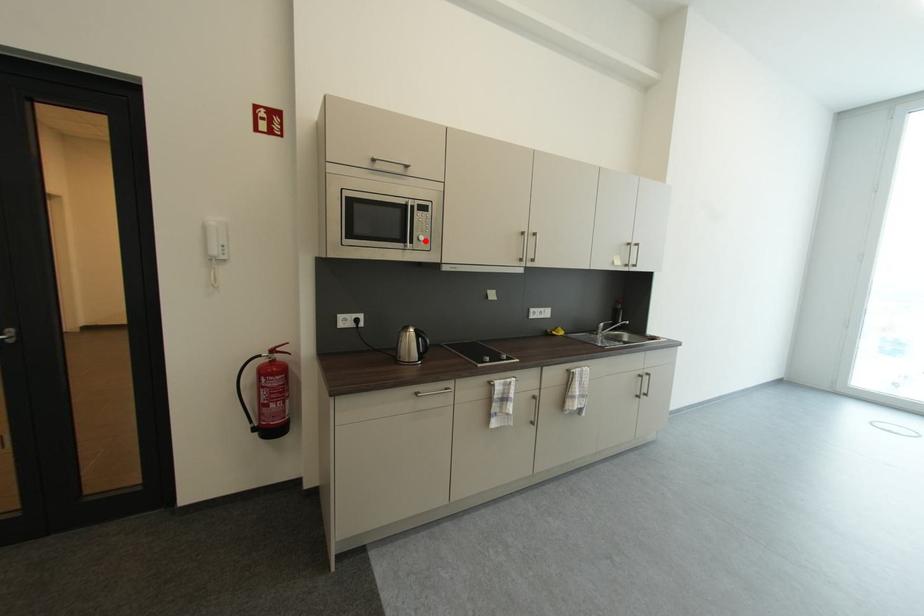
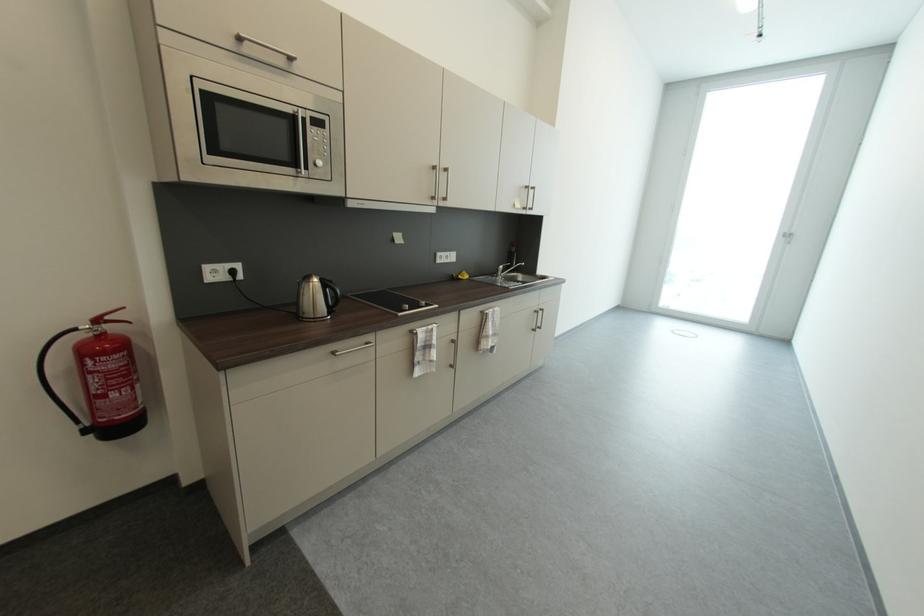
Find the pixel in the second image that matches the highlighted location in the first image.

(322, 166)